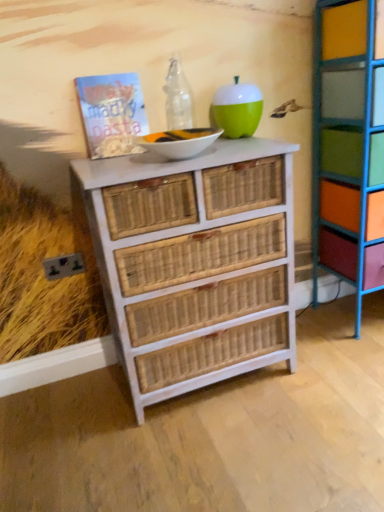
Question: Considering the relative sizes of matte paper book at upper left and green matte apple at upper center in the image provided, is matte paper book at upper left taller than green matte apple at upper center?

Choices:
 (A) yes
 (B) no

Answer: (A)

Question: From the image's perspective, would you say matte paper book at upper left is shown under green matte apple at upper center?

Choices:
 (A) yes
 (B) no

Answer: (A)

Question: Is matte paper book at upper left outside of green matte apple at upper center?

Choices:
 (A) yes
 (B) no

Answer: (A)

Question: From a real-world perspective, does matte paper book at upper left sit lower than green matte apple at upper center?

Choices:
 (A) yes
 (B) no

Answer: (B)

Question: Is matte paper book at upper left directly adjacent to green matte apple at upper center?

Choices:
 (A) no
 (B) yes

Answer: (A)

Question: Considering the positions of green matte apple at upper center and white wicker chest of drawers at center in the image, is green matte apple at upper center taller or shorter than white wicker chest of drawers at center?

Choices:
 (A) tall
 (B) short

Answer: (B)

Question: From the image's perspective, is green matte apple at upper center positioned above or below white wicker chest of drawers at center?

Choices:
 (A) below
 (B) above

Answer: (B)

Question: Is green matte apple at upper center wider or thinner than white wicker chest of drawers at center?

Choices:
 (A) wide
 (B) thin

Answer: (B)

Question: From a real-world perspective, is green matte apple at upper center positioned above or below white wicker chest of drawers at center?

Choices:
 (A) below
 (B) above

Answer: (B)

Question: Is multicolored painted wood shelf at right in front of or behind green matte apple at upper center in the image?

Choices:
 (A) front
 (B) behind

Answer: (A)

Question: Considering the positions of multicolored painted wood shelf at right and green matte apple at upper center in the image, is multicolored painted wood shelf at right taller or shorter than green matte apple at upper center?

Choices:
 (A) short
 (B) tall

Answer: (B)

Question: From a real-world perspective, is multicolored painted wood shelf at right physically located above or below green matte apple at upper center?

Choices:
 (A) below
 (B) above

Answer: (A)

Question: From the image's perspective, relative to green matte apple at upper center, is multicolored painted wood shelf at right above or below?

Choices:
 (A) above
 (B) below

Answer: (B)

Question: From a real-world perspective, is matte paper book at upper left above or below multicolored painted wood shelf at right?

Choices:
 (A) below
 (B) above

Answer: (B)

Question: From the image's perspective, relative to multicolored painted wood shelf at right, is matte paper book at upper left above or below?

Choices:
 (A) below
 (B) above

Answer: (B)